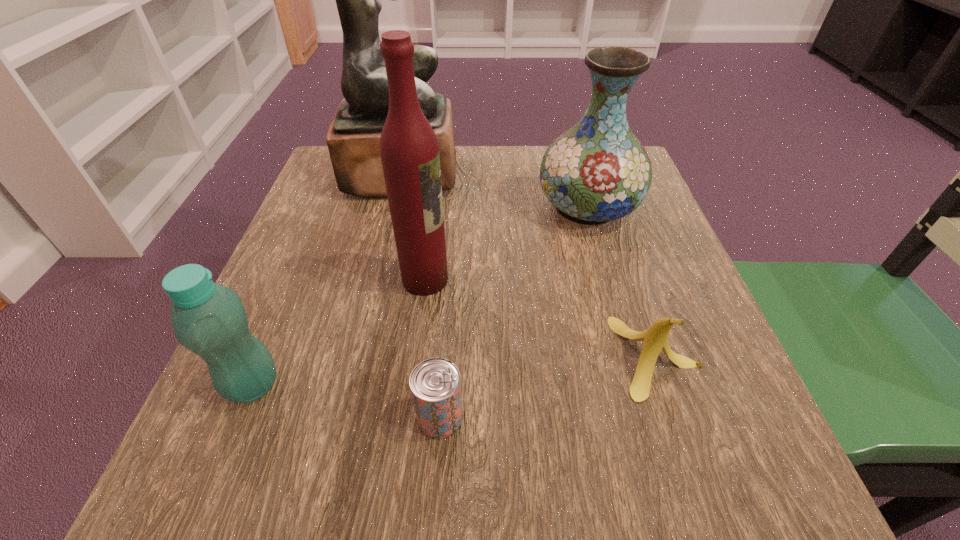
Find the location of a particular element. Image resolution: width=960 pixels, height=540 pixels. free space between the sculpture and the vase is located at coordinates (494, 191).

This screenshot has width=960, height=540. In order to click on empty space between the beer can and the water bottle in this screenshot , I will do `click(347, 401)`.

Find the location of a particular element. free space between the shortest object and the fourth tallest object is located at coordinates (347, 401).

Where is `free spot between the tallest object and the fifth tallest object`? This screenshot has width=960, height=540. free spot between the tallest object and the fifth tallest object is located at coordinates (530, 265).

Find the location of a particular element. This screenshot has width=960, height=540. the third closest object to the vase is located at coordinates (656, 338).

Find the location of a particular element. This screenshot has height=540, width=960. the third closest object to the fourth tallest object is located at coordinates (353, 139).

Where is `free space that satisfies the following two spatial constraints: 1. at the front cap of the water bottle; 2. on the back side of the beer can`? free space that satisfies the following two spatial constraints: 1. at the front cap of the water bottle; 2. on the back side of the beer can is located at coordinates (239, 417).

Locate an element on the screen. Image resolution: width=960 pixels, height=540 pixels. free spot that satisfies the following two spatial constraints: 1. on the front side of the fifth tallest object; 2. on the left side of the fourth shortest object is located at coordinates (631, 356).

I want to click on free location that satisfies the following two spatial constraints: 1. on the back side of the banana; 2. on the label of the fourth nearest object, so click(x=631, y=279).

Identify the location of vacant position in the image that satisfies the following two spatial constraints: 1. at the front cap of the water bottle; 2. on the right side of the shortest object. This screenshot has width=960, height=540. (239, 417).